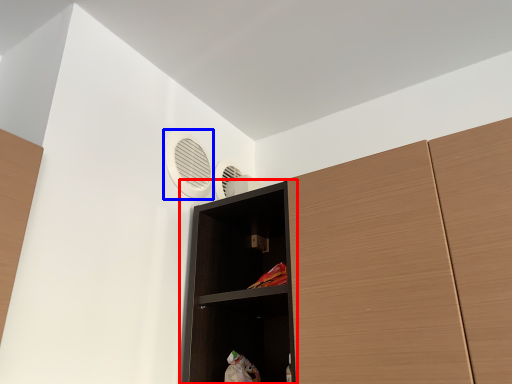
Question: Which object is closer to the camera taking this photo, shelf (highlighted by a red box) or air conditioning (highlighted by a blue box)?

Choices:
 (A) shelf
 (B) air conditioning

Answer: (A)